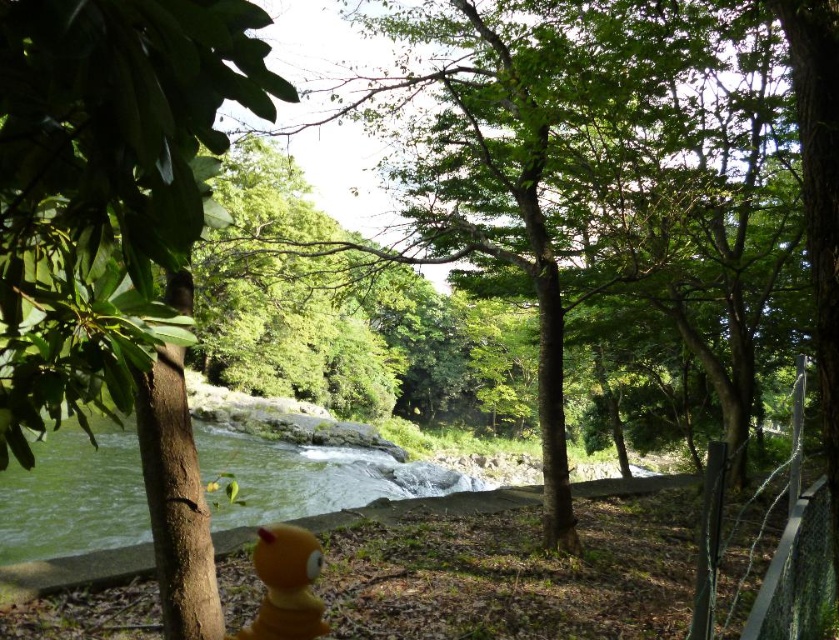
You are a hiker who needs to cross the river. You see the green liquid water at center and the black wire mesh at right. Which path has a wider passage for you to walk through?

The green liquid water at center has a wider passage than the black wire mesh at right because its width is larger.

In the scene shown: You are a hiker who wants to cross the river shown in the image. You see the green liquid water at center and the black wire mesh at right. Which object is bigger in size?

The green liquid water at center is larger in size than the black wire mesh at right.

You are standing at the origin point in the image. Based on the coordinates provided, in which direction should you move to reach the green liquid water at center?

The green liquid water at center is located at coordinates point (74, 496), so you should move to the right and slightly downward to reach it.